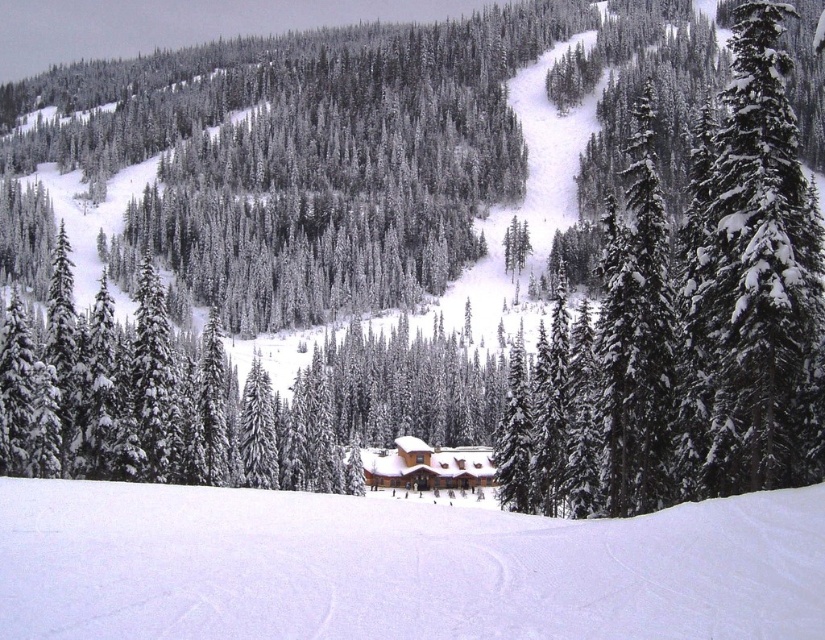
Question: Estimate the real-world distances between objects in this image. Which object is farther from the snow-covered evergreen at right?

Choices:
 (A) white snow ski slope at center
 (B) brown wooden cabin at center

Answer: (B)

Question: Does white snow ski slope at center appear over brown wooden cabin at center?

Choices:
 (A) no
 (B) yes

Answer: (B)

Question: Based on their relative distances, which object is nearer to the green textured pine tree at upper center?

Choices:
 (A) white snow ski slope at center
 (B) brown wooden cabin at center
 (C) snow-covered evergreen at right

Answer: (C)

Question: Does green textured pine tree at upper center appear on the left side of brown wooden cabin at center?

Choices:
 (A) yes
 (B) no

Answer: (B)

Question: Which point appears closest to the camera in this image?

Choices:
 (A) (717, 188)
 (B) (700, 544)
 (C) (759, 115)
 (D) (417, 488)

Answer: (B)

Question: Is green textured pine tree at upper center in front of brown wooden cabin at center?

Choices:
 (A) yes
 (B) no

Answer: (A)